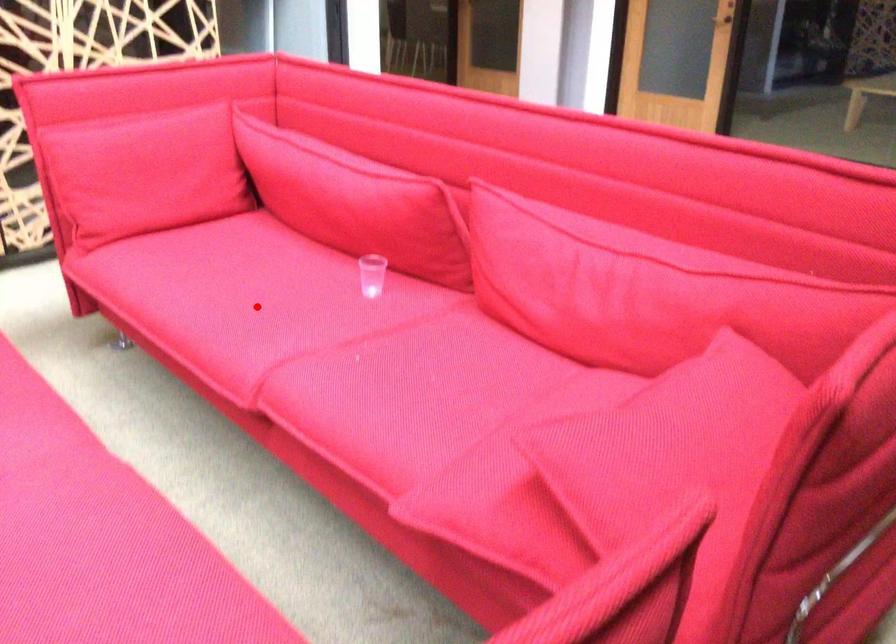
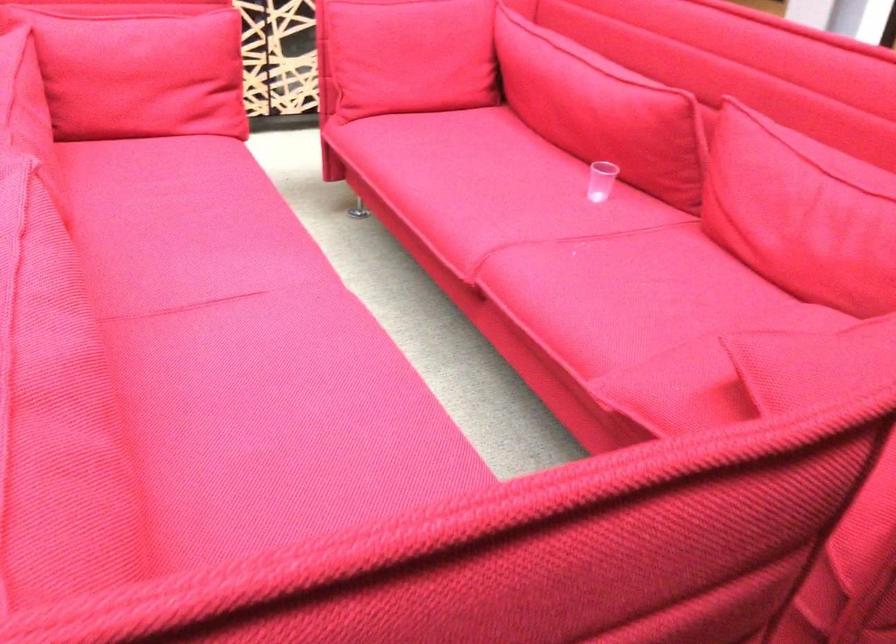
Where in the second image is the point corresponding to the highlighted location from the first image?

(488, 192)